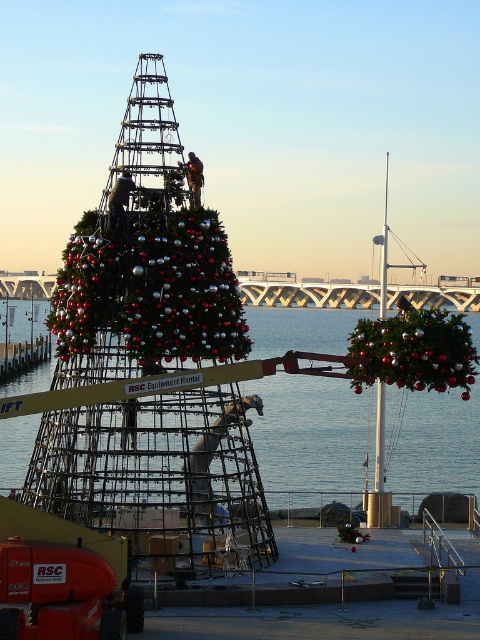
You are a worker standing on the scaffolding next to the clear blue water at center and the shiny metallic garland at right. Which object is closer to your left side?

The clear blue water at center is positioned on the left side of shiny metallic garland at right, so it is closer to your left side.

You are a safety inspector checking the setup of the festive scene. The clear blue water at center and the shiny metallic Christmas tree at left are both present. Which object takes up more space in the image?

The clear blue water at center takes up more space in the image as it is larger in size than the shiny metallic Christmas tree at left.